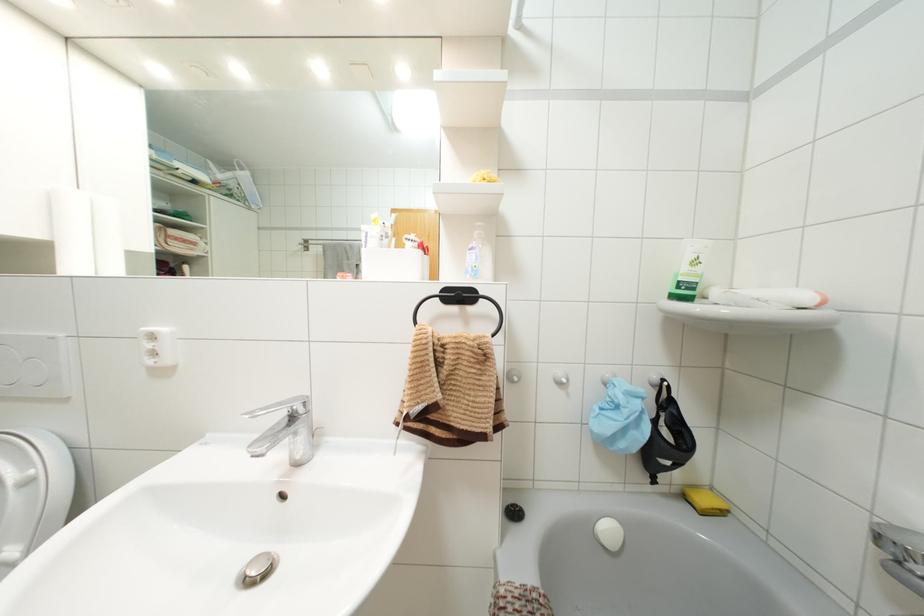
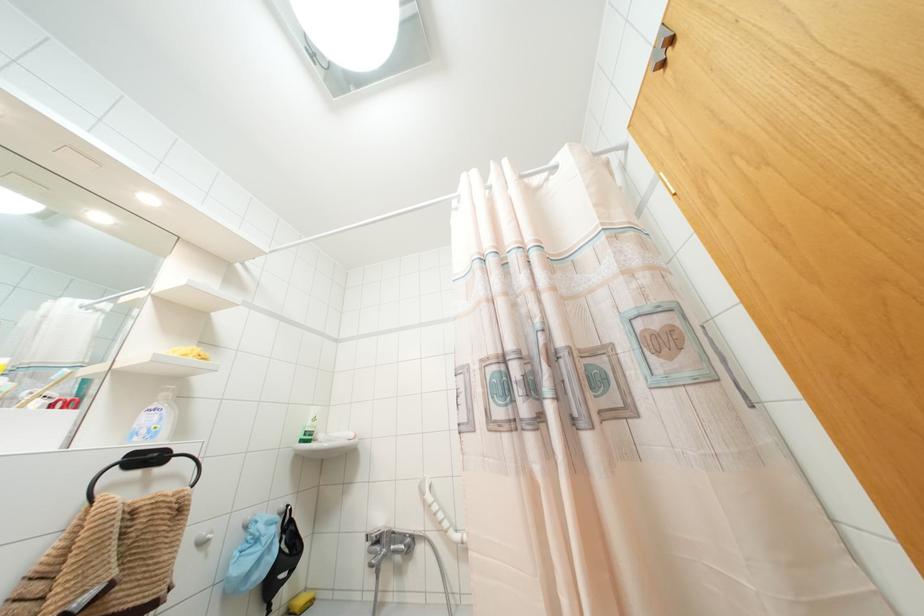
First-person continuous shooting, in which direction is the camera rotating?

The camera rotated toward right-up.